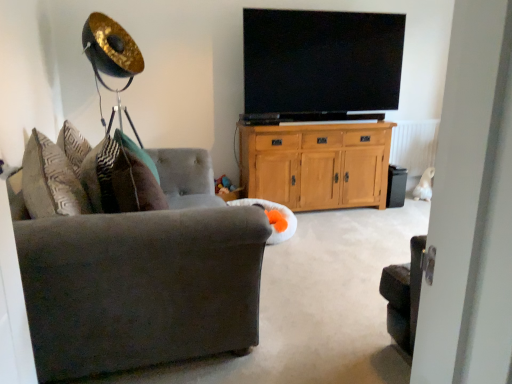
This screenshot has height=384, width=512. In order to click on vacant area located to the right-hand side of velvet gray couch at left in this screenshot , I will do tap(324, 287).